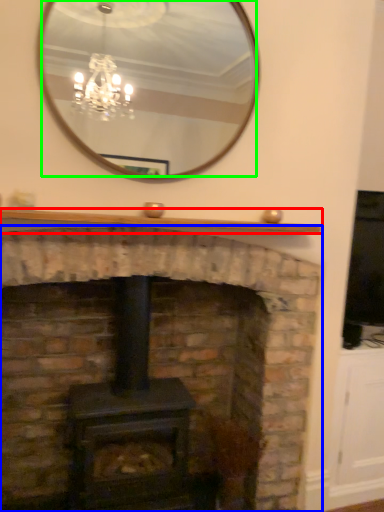
Question: Which is nearer to the mantle (highlighted by a red box)? fireplace (highlighted by a blue box) or mirror (highlighted by a green box).

Choices:
 (A) fireplace
 (B) mirror

Answer: (A)